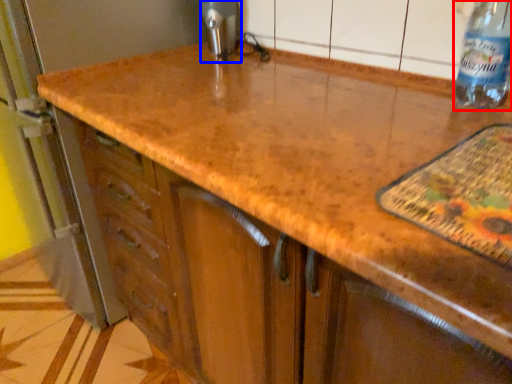
Question: Which point is further to the camera, bottle (highlighted by a red box) or appliance (highlighted by a blue box)?

Choices:
 (A) bottle
 (B) appliance

Answer: (B)